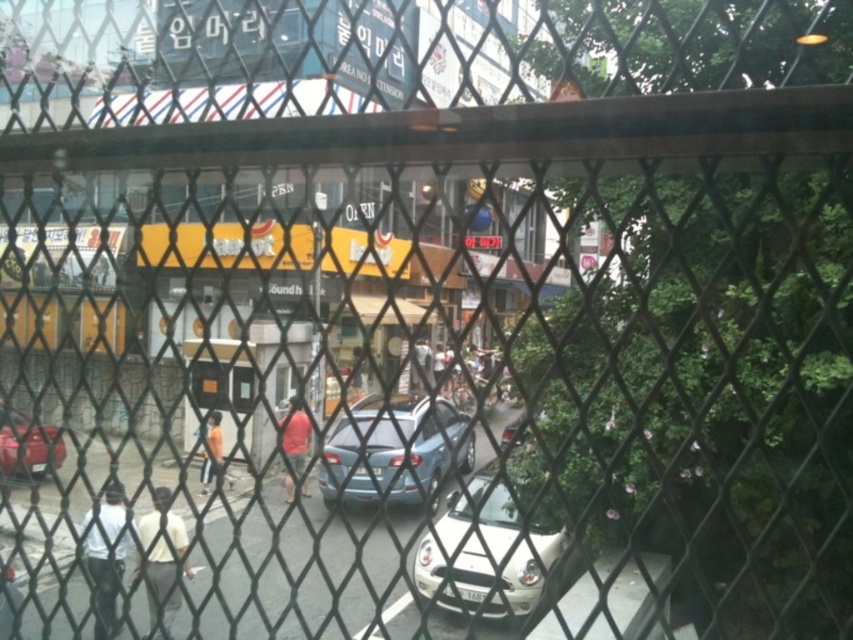
You are standing inside the building looking through the chain link fence. You want to know where the white matte shirt at lower left is located. What are its coordinates?

The white matte shirt at lower left is located at coordinates point (x=106, y=557).

You are standing inside the building looking through the chain link fence. There is a point at coordinates point (113, 486). Can you estimate how far that point is from you?

The point at (113, 486) is 9.11 meters away from the viewer.